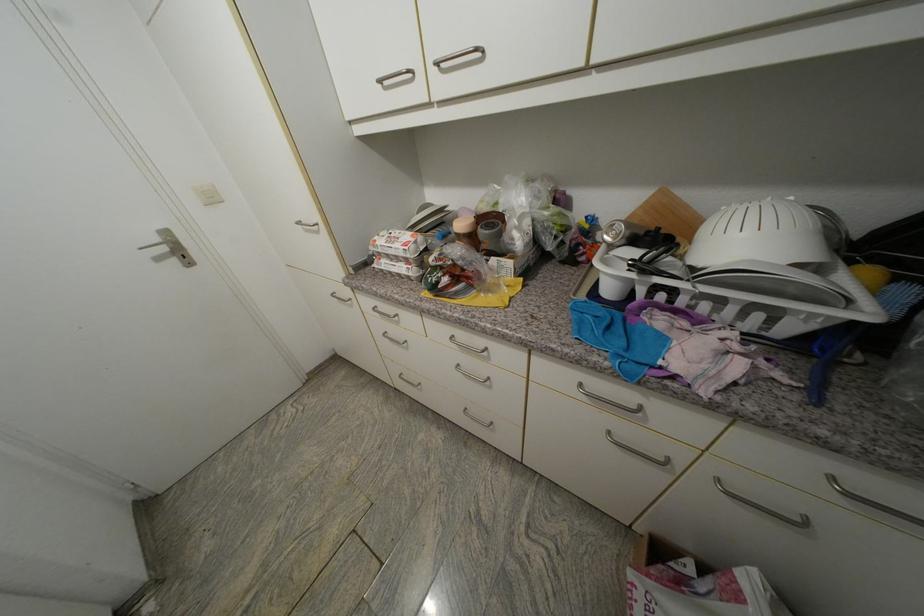
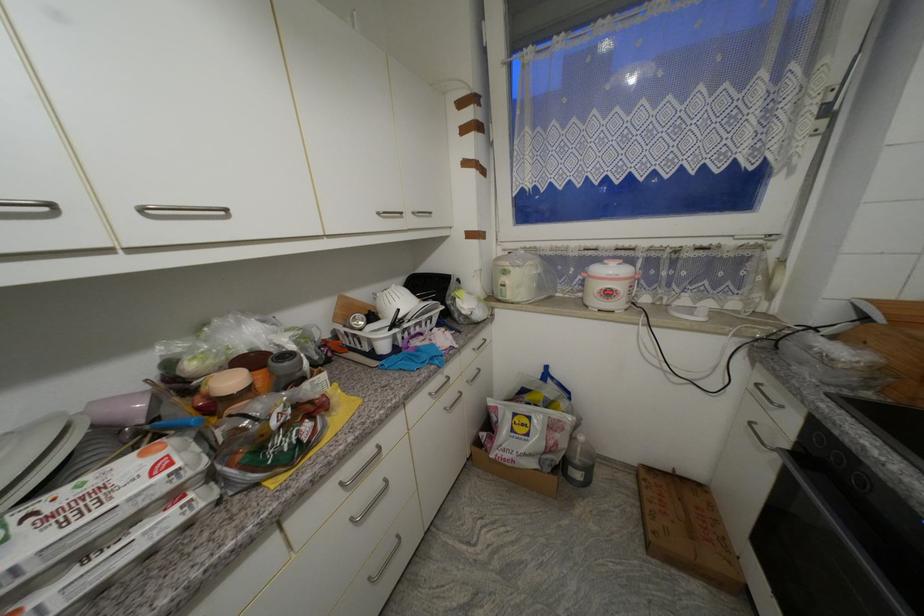
The point at (444,67) is marked in the first image. Where is the corresponding point in the second image?

(149, 211)